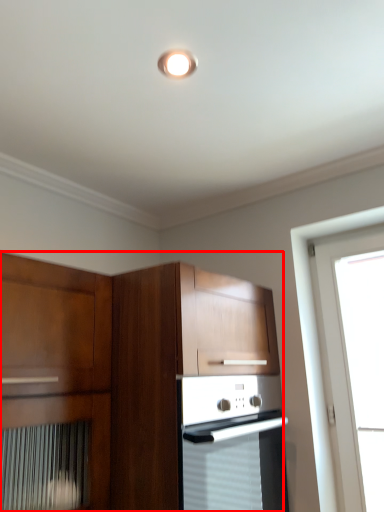
Question: From the image's perspective, where is cabinetry (annotated by the red box) located relative to light fixture?

Choices:
 (A) above
 (B) below

Answer: (B)